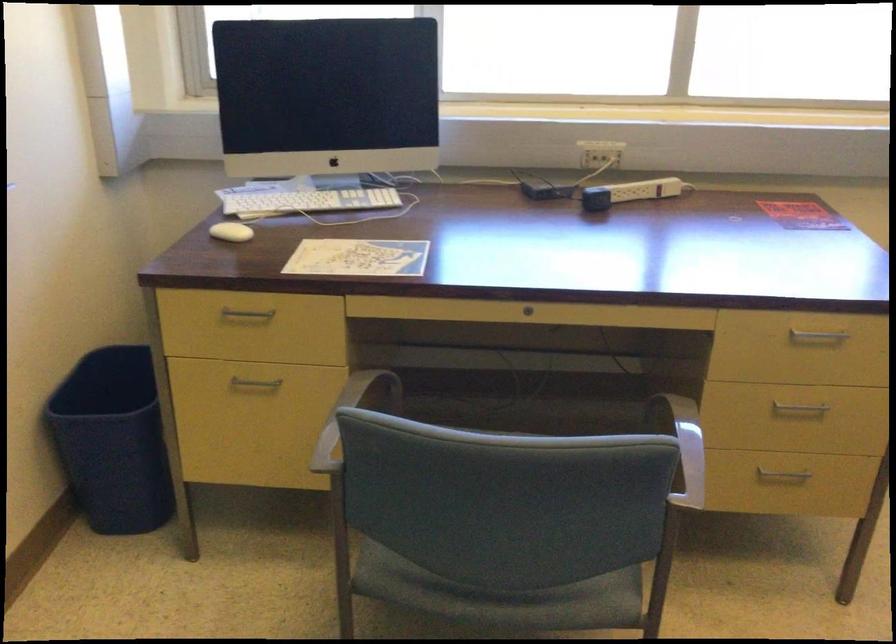
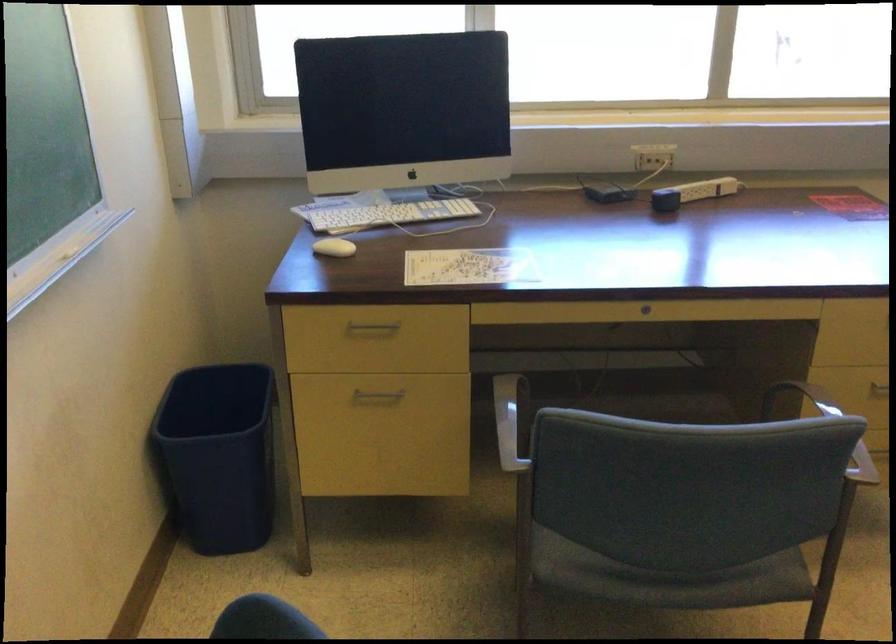
Where in the second image is the point corresponding to pixel 596 202 from the first image?

(665, 200)